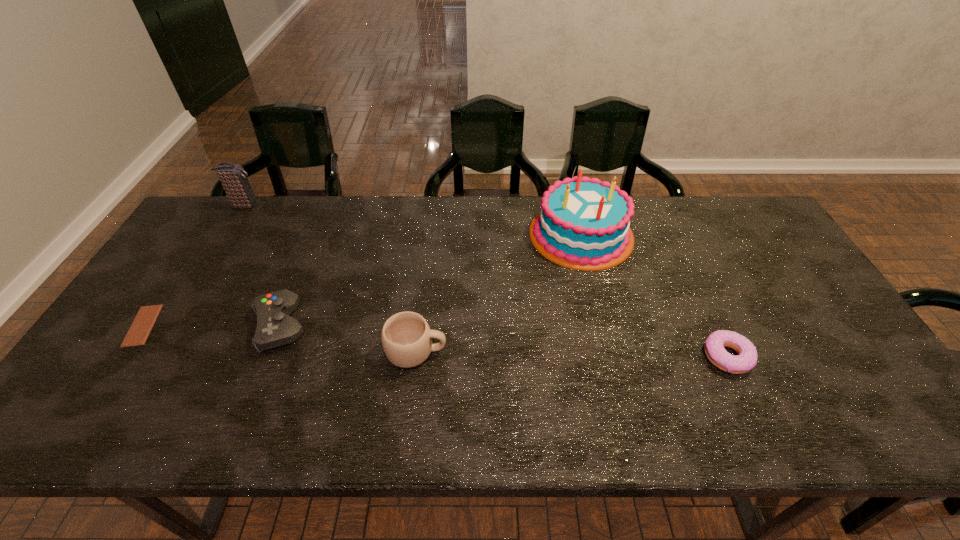
This screenshot has width=960, height=540. What are the coordinates of `free space between the second shortest object and the shortest object` in the screenshot? It's located at (435, 341).

Where is `free space between the control and the doughnut`? This screenshot has height=540, width=960. free space between the control and the doughnut is located at coordinates (504, 341).

Where is `empty location between the doughnut and the fourth object from left to right`? empty location between the doughnut and the fourth object from left to right is located at coordinates (571, 354).

Locate an element on the screen. empty space that is in between the tallest object and the rightmost object is located at coordinates (654, 295).

Where is `free area in between the fourth tallest object and the fourth shortest object`? The image size is (960, 540). free area in between the fourth tallest object and the fourth shortest object is located at coordinates (348, 339).

Locate which object ranks second in proximity to the tallest object. Please provide its 2D coordinates. Your answer should be formatted as a tuple, i.e. [(x, y)], where the tuple contains the x and y coordinates of a point satisfying the conditions above.

[(406, 338)]

Point out which object is positioned as the fourth nearest to the second shortest object. Please provide its 2D coordinates. Your answer should be formatted as a tuple, i.e. [(x, y)], where the tuple contains the x and y coordinates of a point satisfying the conditions above.

[(144, 321)]

Find the location of `vacant region that satisfies the following two spatial constraints: 1. on the back side of the chocolate bar; 2. on the left side of the tallest object`. vacant region that satisfies the following two spatial constraints: 1. on the back side of the chocolate bar; 2. on the left side of the tallest object is located at coordinates (204, 234).

Locate an element on the screen. vacant space that satisfies the following two spatial constraints: 1. on the back side of the doughnut; 2. with the zip open on the clutch bag is located at coordinates (658, 205).

The height and width of the screenshot is (540, 960). I want to click on vacant space that satisfies the following two spatial constraints: 1. with the zip open on the clutch bag; 2. on the back side of the birthday cake, so click(x=227, y=234).